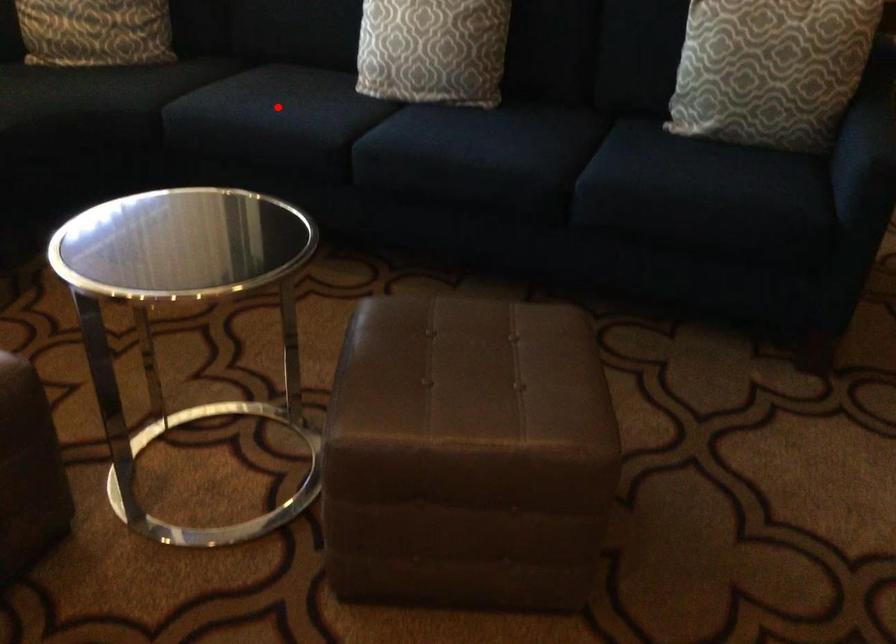
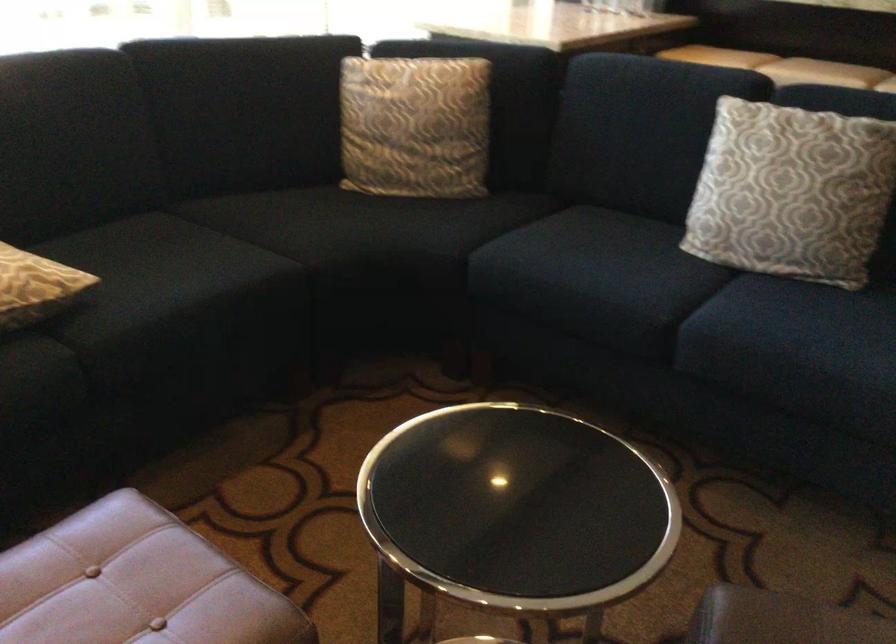
In the second image, find the point that corresponds to the highlighted location in the first image.

(590, 274)